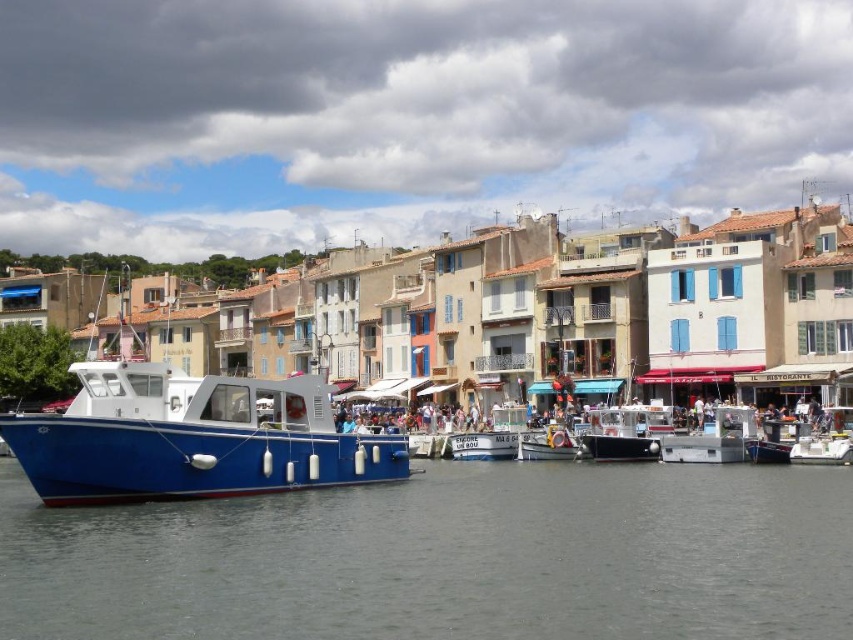
This screenshot has width=853, height=640. Find the location of `gray water at lower center`. gray water at lower center is located at coordinates (445, 557).

Who is shorter, gray water at lower center or metallic silver boat at center?

With less height is metallic silver boat at center.

Who is more forward, (180, 588) or (549, 444)?

Point (180, 588) is in front.

You are a GUI agent. You are given a task and a screenshot of the screen. Output one action in this format:
    pyautogui.click(x=<x>, y=<y>)
    Task: Click on the gray water at lower center
    
    Given the screenshot: What is the action you would take?
    pyautogui.click(x=445, y=557)

Who is lower down, black matte boat at center or metallic silver boat at center?

Positioned lower is metallic silver boat at center.

Which is in front, point (641, 424) or point (548, 454)?

Point (641, 424) is more forward.

Locate an element on the screen. black matte boat at center is located at coordinates (625, 433).

Is point (120, 570) positioned behind point (610, 412)?

No, it is in front of (610, 412).

Does gray water at lower center have a smaller size compared to black matte boat at center?

No, gray water at lower center is not smaller than black matte boat at center.

Identify the location of gray water at lower center. The image size is (853, 640). (445, 557).